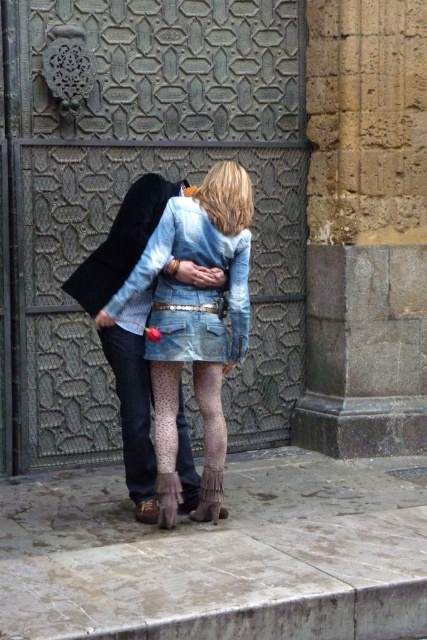
You are standing in front of the gate and need to locate a specific point marked as point (132, 406). Based on the scene description, where exactly is this point located?

The point (132, 406) is located on the denim skirt at lower center.

You are standing in front of a historical gate and want to take a photo of the denim skirt at lower center. If your camera can focus on objects up to 15 feet away, will you need to move closer to take a clear photo?

The denim skirt at lower center is 16.93 feet away from the viewer. Since the camera can only focus up to 15 feet, you will need to move closer to ensure the denim skirt at lower center is within the focus range.